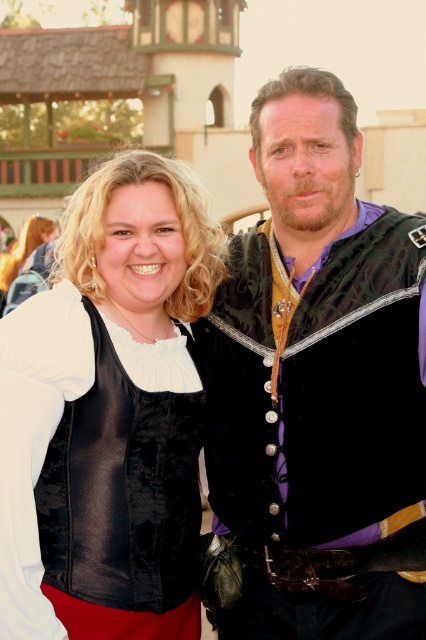
How far apart are velvet/black vest at center and velvet black vest at left?

The distance of velvet/black vest at center from velvet black vest at left is 3.57 meters.

Can you confirm if velvet/black vest at center is shorter than velvet black vest at left?

No, velvet/black vest at center is not shorter than velvet black vest at left.

The height and width of the screenshot is (640, 426). What do you see at coordinates (319, 387) in the screenshot? I see `velvet/black vest at center` at bounding box center [319, 387].

The width and height of the screenshot is (426, 640). I want to click on velvet/black vest at center, so click(319, 387).